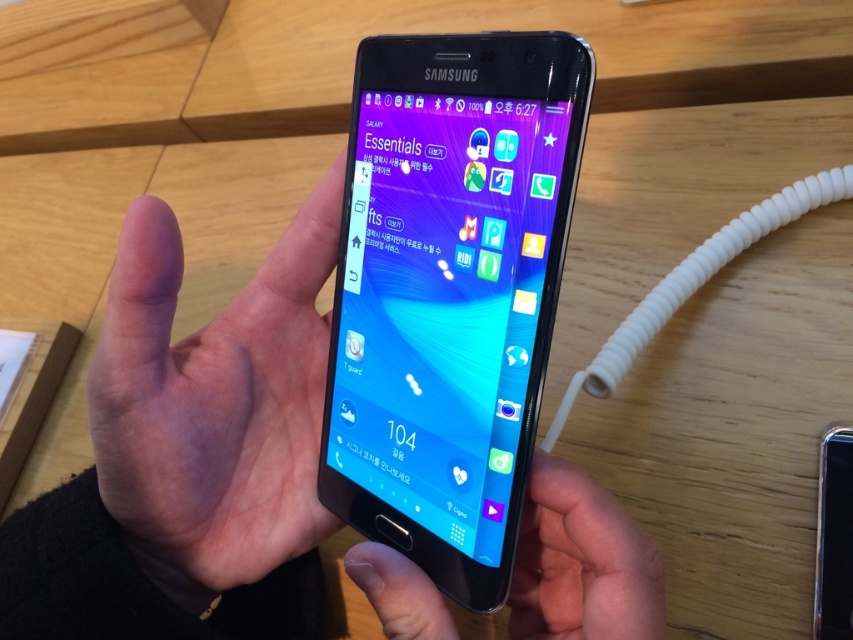
Which of these two, pink flesh at center or metallic silver phone at center, stands taller?

Standing taller between the two is pink flesh at center.

This screenshot has width=853, height=640. What do you see at coordinates (213, 404) in the screenshot?
I see `pink flesh at center` at bounding box center [213, 404].

Is point (192, 484) less distant than point (838, 483)?

That is True.

You are a GUI agent. You are given a task and a screenshot of the screen. Output one action in this format:
    pyautogui.click(x=<x>, y=<y>)
    Task: Click on the pink flesh at center
    This screenshot has height=640, width=853.
    Given the screenshot: What is the action you would take?
    pyautogui.click(x=213, y=404)

Is satin black phone at center further to camera compared to matte black phone at center?

No.

Image resolution: width=853 pixels, height=640 pixels. I want to click on satin black phone at center, so click(450, 291).

Who is more forward, (260, 602) or (332, 316)?

Point (332, 316)

This screenshot has height=640, width=853. What are the coordinates of `black matte phone at center` in the screenshot? It's located at (189, 449).

Where is `black matte phone at center`? This screenshot has height=640, width=853. black matte phone at center is located at coordinates (189, 449).